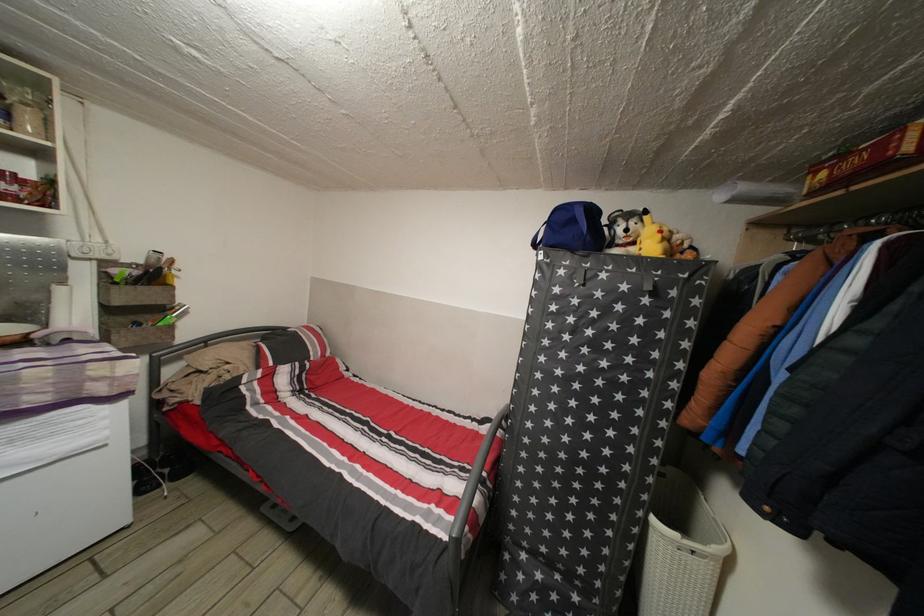
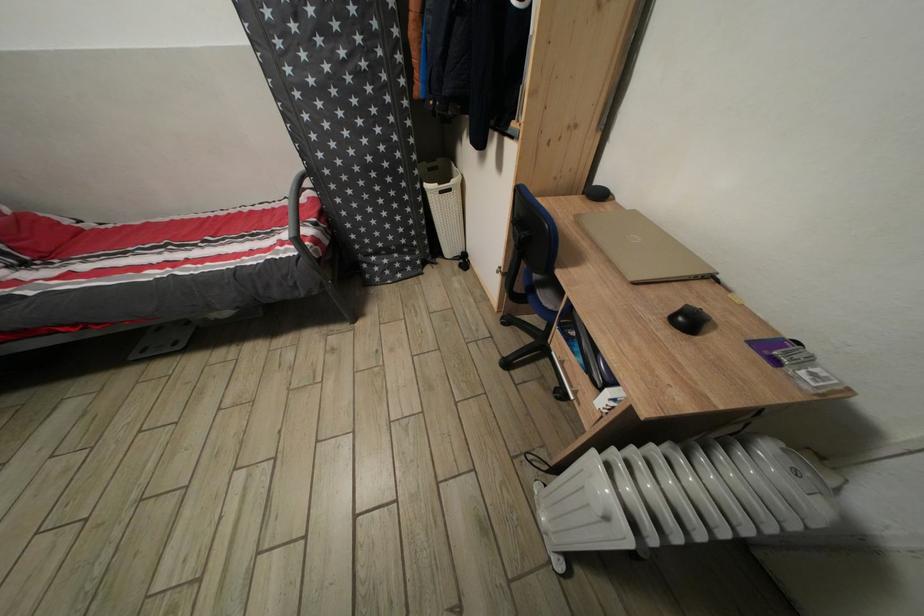
In the second image, find the point that corresponds to point (546, 476) in the first image.

(357, 198)